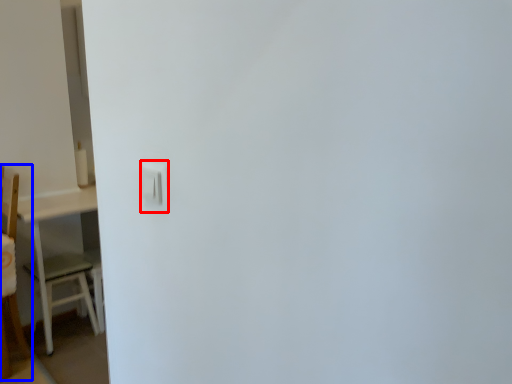
Question: Which object appears closest to the camera in this image, light switch (highlighted by a red box) or furniture (highlighted by a blue box)?

Choices:
 (A) light switch
 (B) furniture

Answer: (A)